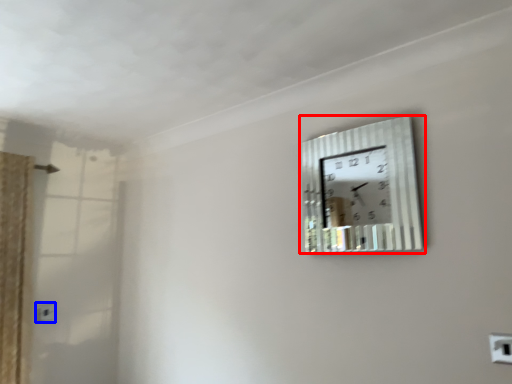
Question: Which object appears farthest to the camera in this image, wall clock (highlighted by a red box) or electric outlet (highlighted by a blue box)?

Choices:
 (A) wall clock
 (B) electric outlet

Answer: (B)